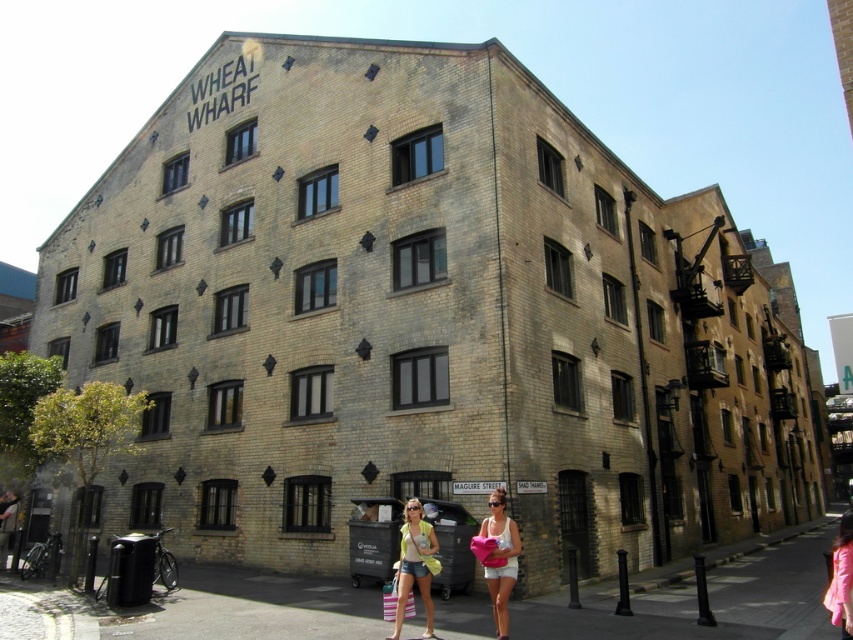
Is yellow cotton tank top at lower center smaller than matte white shorts at lower center?

Indeed, yellow cotton tank top at lower center has a smaller size compared to matte white shorts at lower center.

Which of these two, yellow cotton tank top at lower center or matte white shorts at lower center, stands taller?

Standing taller between the two is matte white shorts at lower center.

Which is in front, point (430, 616) or point (503, 632)?

Point (503, 632) is in front.

Locate an element on the screen. The height and width of the screenshot is (640, 853). yellow cotton tank top at lower center is located at coordinates (415, 564).

Who is more distant from viewer, (326,634) or (844,582)?

Positioned behind is point (326,634).

What do you see at coordinates (708, 595) in the screenshot? I see `smooth concrete pavement at lower center` at bounding box center [708, 595].

I want to click on smooth concrete pavement at lower center, so click(x=708, y=595).

Which is in front, point (712, 561) or point (511, 563)?

Point (511, 563)

Who is more distant from viewer, (x=279, y=579) or (x=492, y=524)?

The point (x=279, y=579) is behind.

You are a GUI agent. You are given a task and a screenshot of the screen. Output one action in this format:
    pyautogui.click(x=<x>, y=<y>)
    Task: Click on the smooth concrete pavement at lower center
    Image resolution: width=853 pixels, height=640 pixels.
    Given the screenshot: What is the action you would take?
    pyautogui.click(x=708, y=595)